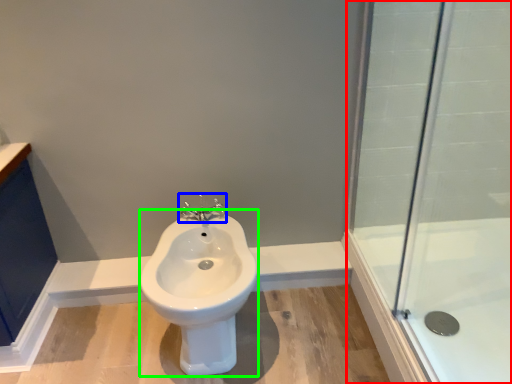
Question: Which object is positioned farthest from shower door (highlighted by a red box)? Select from tap (highlighted by a blue box) and bidet (highlighted by a green box).

Choices:
 (A) tap
 (B) bidet

Answer: (A)